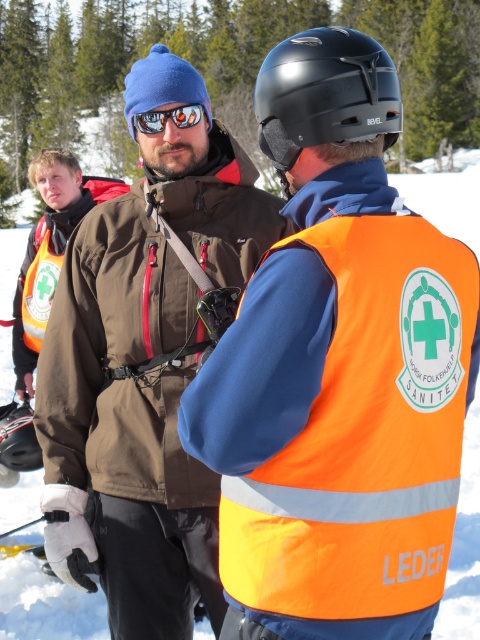
Does matte brown jacket at center appear on the right side of black matte helmet at center?

In fact, matte brown jacket at center is to the left of black matte helmet at center.

Between matte brown jacket at center and black matte helmet at center, which one appears on the left side from the viewer's perspective?

From the viewer's perspective, matte brown jacket at center appears more on the left side.

Is point (199, 218) closer to viewer compared to point (386, 96)?

That is False.

At what (x,y) coordinates should I click in order to perform the action: click on matte brown jacket at center. Please return your answer as a coordinate pair (x, y). The image size is (480, 640). Looking at the image, I should click on (144, 365).

Which is more to the left, orange reflective safety vest at center or orange reflective safety vest at left?

From the viewer's perspective, orange reflective safety vest at left appears more on the left side.

Which is more to the right, orange reflective safety vest at center or orange reflective safety vest at left?

Positioned to the right is orange reflective safety vest at center.

Is point (414, 525) farther from camera compared to point (58, 275)?

No.

The width and height of the screenshot is (480, 640). I want to click on orange reflective safety vest at center, so [x=365, y=435].

Between matte brown jacket at center and orange reflective safety vest at center, which one is positioned lower?

orange reflective safety vest at center is below.

Which is more to the right, matte brown jacket at center or orange reflective safety vest at center?

orange reflective safety vest at center is more to the right.

In order to click on matte brown jacket at center in this screenshot , I will do `click(144, 365)`.